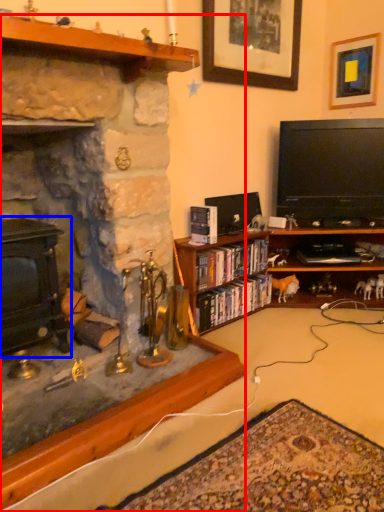
Question: Which of the following is the closest to the observer, fireplace (highlighted by a red box) or fireplace (highlighted by a blue box)?

Choices:
 (A) fireplace
 (B) fireplace

Answer: (A)